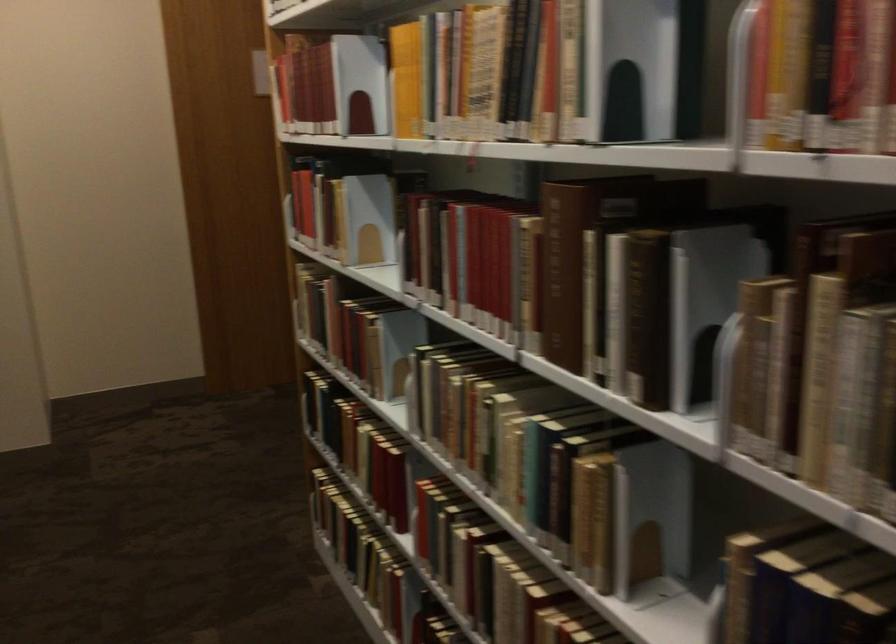
What do you see at coordinates (259, 61) in the screenshot?
I see `the light switch` at bounding box center [259, 61].